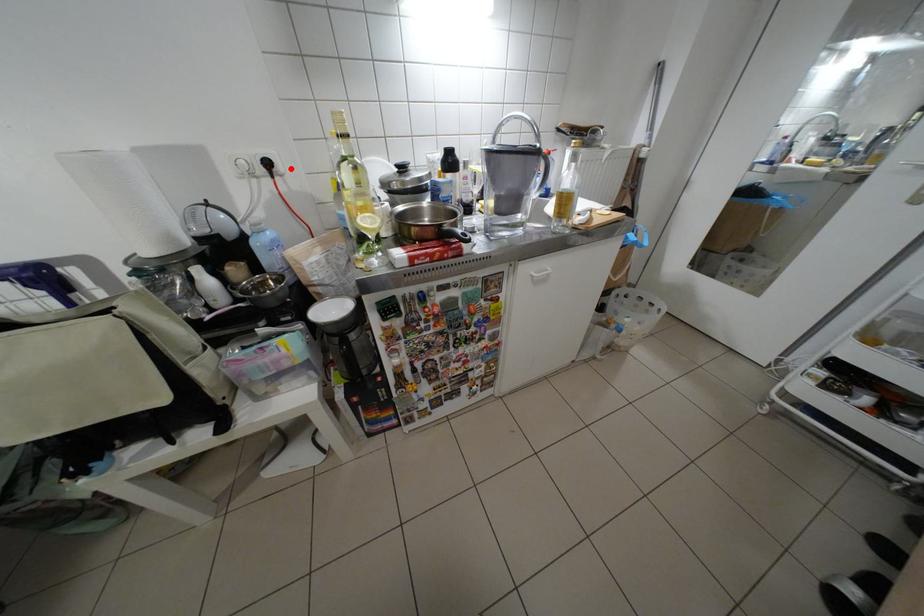
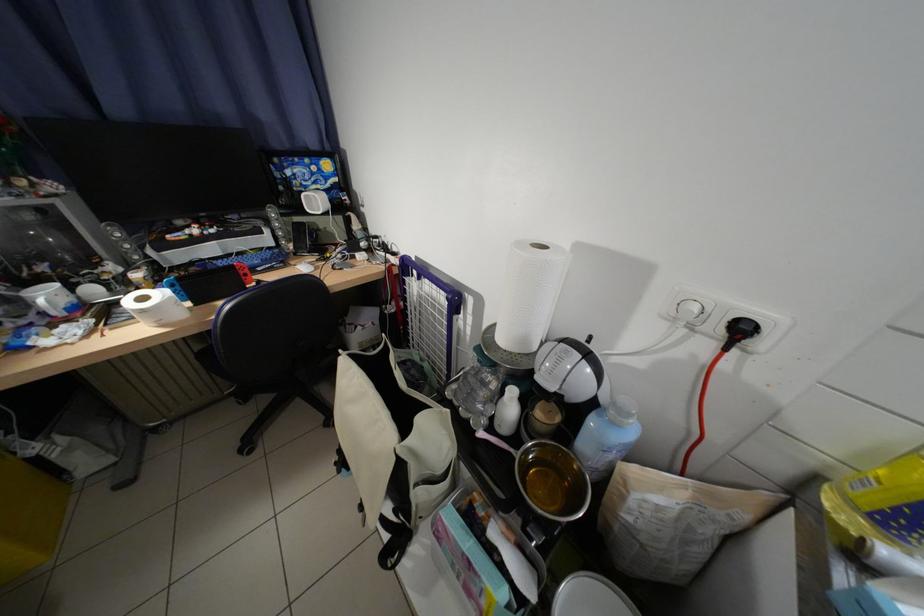
Locate, in the second image, the point that corresponds to the highlighted location in the first image.

(772, 345)